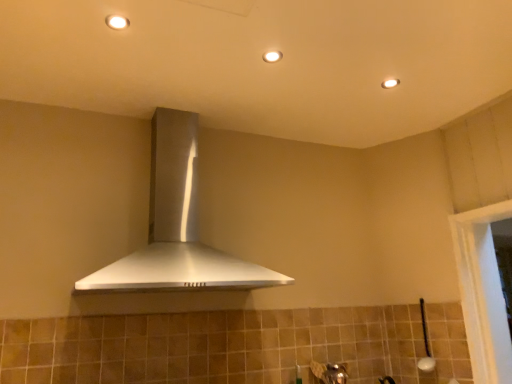
Question: Is matte white light fixture at upper center, which is counted as the first light fixture, starting from the bottom, inside the boundaries of white glossy light fixture at upper center, which ranks as the first light fixture in front-to-back order, or outside?

Choices:
 (A) outside
 (B) inside

Answer: (A)

Question: From the image's perspective, is matte white light fixture at upper center, positioned as the first light fixture in right-to-left order, above or below white glossy light fixture at upper center, which ranks as the first light fixture in front-to-back order?

Choices:
 (A) below
 (B) above

Answer: (A)

Question: Estimate the real-world distances between objects in this image. Which object is farther from the white glossy light fixture at upper center, which is counted as the 3th light fixture, starting from the right?

Choices:
 (A) satin silver range hood at center
 (B) matte white light fixture at upper center, the second light fixture when ordered from left to right
 (C) matte white light fixture at upper center, which is counted as the first light fixture, starting from the bottom

Answer: (C)

Question: Considering the real-world distances, which object is farthest from the satin silver range hood at center?

Choices:
 (A) white glossy light fixture at upper center, which is counted as the 3th light fixture, starting from the right
 (B) matte white light fixture at upper center, the 1th light fixture positioned from the back
 (C) matte white light fixture at upper center, the second light fixture viewed from the front

Answer: (B)